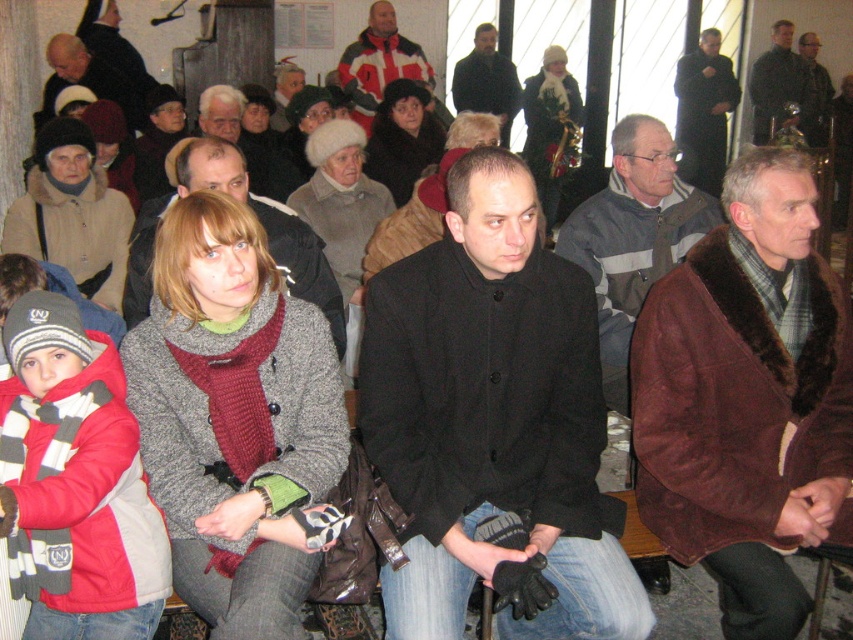
You are standing at the entrance of the room and want to find the black woolen coat at center. According to the coordinates provided, in which direction should you move to locate it?

The black woolen coat at center is located at coordinates point 0.653 on the x axis and 0.578 on the y axis. Since you are at the entrance, you should move towards the center of the room to find it.

You are a photographer trying to capture a photo of the white and red striped jacket at center and the dark gray wool coat at upper right. Based on their heights, which one would you need to adjust your camera angle upwards to focus on?

The white and red striped jacket at center is much taller than the dark gray wool coat at upper right, so you would need to adjust your camera angle upwards to focus on the white and red striped jacket at center.

You are organizing a clothing donation drive and need to know the spatial arrangement of the items. Which item is positioned to the right of the other between the gray striped sweater at center and the dark gray wool coat at center?

The gray striped sweater at center is positioned to the right of the dark gray wool coat at center.